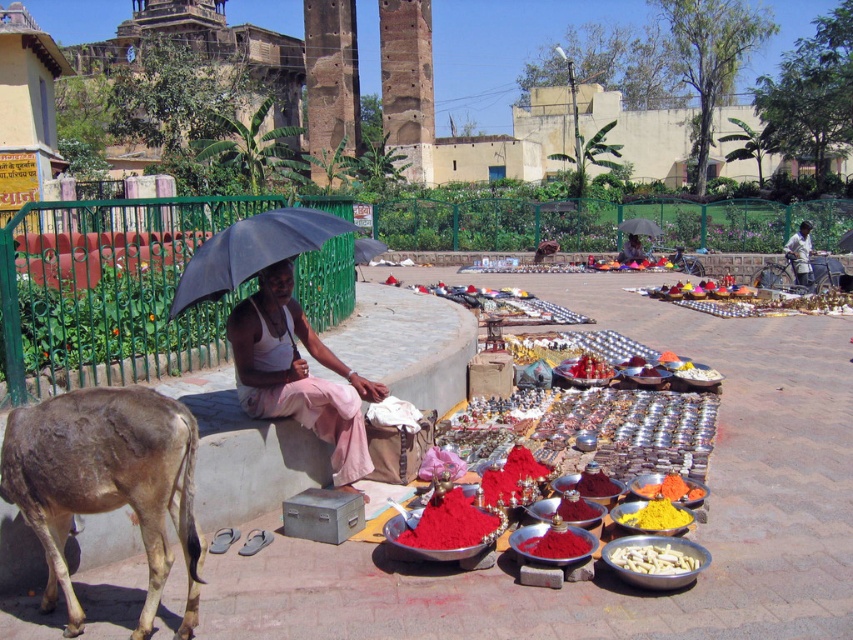
Question: Can you confirm if black matte umbrella at center is positioned to the right of red powder at center?

Choices:
 (A) no
 (B) yes

Answer: (A)

Question: Which object is closer to the camera taking this photo?

Choices:
 (A) powdered red spice at center
 (B) white matte food at lower center

Answer: (B)

Question: Which point is closer to the camera taking this photo?

Choices:
 (A) (802, 252)
 (B) (636, 220)
 (C) (440, 544)
 (D) (599, 470)

Answer: (C)

Question: Does white cotton shirt at center have a smaller size compared to red powder at center?

Choices:
 (A) yes
 (B) no

Answer: (B)

Question: Does yellow powder at center appear on the left side of powdered red spice at center?

Choices:
 (A) no
 (B) yes

Answer: (A)

Question: Which point is farther to the camera?

Choices:
 (A) (642, 522)
 (B) (648, 225)
 (C) (531, 541)
 (D) (485, 528)

Answer: (B)